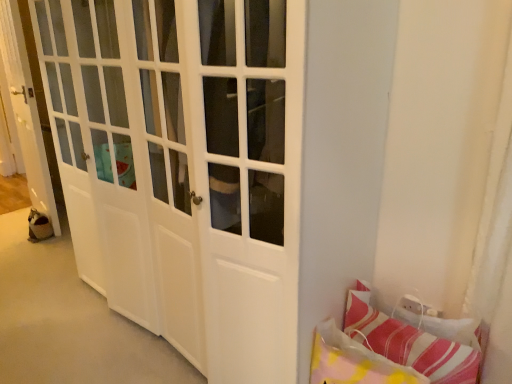
Question: From a real-world perspective, relative to striped fabric pillow at lower right, the 2th pillow in the left-to-right sequence, is striped fabric pillow at lower right, which is the 1th pillow from left to right, vertically above or below?

Choices:
 (A) below
 (B) above

Answer: (A)

Question: Does point (357, 375) appear closer or farther from the camera than point (387, 336)?

Choices:
 (A) farther
 (B) closer

Answer: (B)

Question: Which object is positioned farthest from the striped fabric pillow at lower right, which appears as the 1th pillow when viewed from the right?

Choices:
 (A) white glossy door at left
 (B) striped fabric pillow at lower right, which ranks as the second pillow in right-to-left order

Answer: (A)

Question: Based on their relative distances, which object is nearer to the white glossy door at left?

Choices:
 (A) striped fabric pillow at lower right, which appears as the 1th pillow when viewed from the right
 (B) striped fabric pillow at lower right, which is the 1th pillow from left to right

Answer: (B)